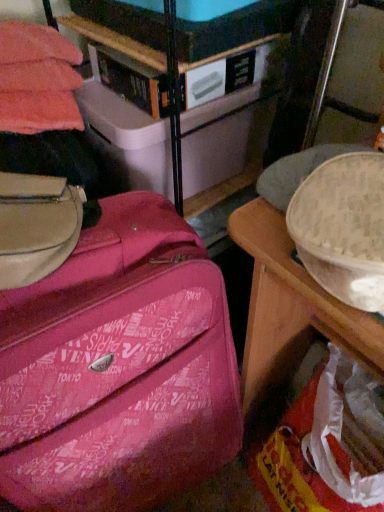
This screenshot has height=512, width=384. What are the coordinates of `pink fabric suitcase at center` in the screenshot? It's located at (118, 368).

Measure the distance between pink fabric suitcase at center and camera.

A distance of 20.51 inches exists between pink fabric suitcase at center and camera.

The height and width of the screenshot is (512, 384). Describe the element at coordinates (118, 368) in the screenshot. I see `pink fabric suitcase at center` at that location.

At what (x,y) coordinates should I click in order to perform the action: click on matte white storage box at upper center. Please return your answer as a coordinate pair (x, y). Image resolution: width=384 pixels, height=512 pixels. Looking at the image, I should click on (221, 139).

The image size is (384, 512). Describe the element at coordinates (221, 139) in the screenshot. I see `matte white storage box at upper center` at that location.

Measure the distance between point (130, 142) and camera.

Point (130, 142) is 31.30 inches away from camera.

The width and height of the screenshot is (384, 512). I want to click on pink fabric suitcase at center, so click(x=118, y=368).

Which is more to the left, pink fabric suitcase at center or matte white storage box at upper center?

From the viewer's perspective, pink fabric suitcase at center appears more on the left side.

Is pink fabric suitcase at center closer to camera compared to matte white storage box at upper center?

Yes, it is in front of matte white storage box at upper center.

Between point (124, 444) and point (91, 135), which one is positioned behind?

The point (91, 135) is more distant.

From the image's perspective, which one is positioned higher, pink fabric suitcase at center or matte white storage box at upper center?

matte white storage box at upper center.

From a real-world perspective, which is physically below, pink fabric suitcase at center or matte white storage box at upper center?

pink fabric suitcase at center is physically lower.

Is pink fabric suitcase at center wider than matte white storage box at upper center?

Indeed, pink fabric suitcase at center has a greater width compared to matte white storage box at upper center.

Can you confirm if pink fabric suitcase at center is shorter than matte white storage box at upper center?

Incorrect, the height of pink fabric suitcase at center does not fall short of that of matte white storage box at upper center.

Can you confirm if pink fabric suitcase at center is smaller than matte white storage box at upper center?

No, pink fabric suitcase at center is not smaller than matte white storage box at upper center.

Would you say pink fabric suitcase at center is inside or outside matte white storage box at upper center?

pink fabric suitcase at center is not enclosed by matte white storage box at upper center.

Is pink fabric suitcase at center in contact with matte white storage box at upper center?

No, pink fabric suitcase at center is not in contact with matte white storage box at upper center.

Is pink fabric suitcase at center positioned with its back to matte white storage box at upper center?

No, pink fabric suitcase at center's orientation is not away from matte white storage box at upper center.

How far apart are pink fabric suitcase at center and matte white storage box at upper center?

pink fabric suitcase at center and matte white storage box at upper center are 14.56 inches apart.

You are a GUI agent. You are given a task and a screenshot of the screen. Output one action in this format:
    pyautogui.click(x=<x>, y=<y>)
    Task: Click on the suitcase located underneath the matte white storage box at upper center (from a real-world perspective)
    The width and height of the screenshot is (384, 512).
    Given the screenshot: What is the action you would take?
    pyautogui.click(x=118, y=368)

Considering the relative positions of matte white storage box at upper center and pink fabric suitcase at center in the image provided, is matte white storage box at upper center to the right of pink fabric suitcase at center from the viewer's perspective?

Correct, you'll find matte white storage box at upper center to the right of pink fabric suitcase at center.

Is matte white storage box at upper center positioned before pink fabric suitcase at center?

No, it is not.

Is point (263, 138) less distant than point (101, 277)?

No, (263, 138) is behind (101, 277).

From the image's perspective, is matte white storage box at upper center located above or below pink fabric suitcase at center?

matte white storage box at upper center is above pink fabric suitcase at center.

From a real-world perspective, which object rests below the other?

pink fabric suitcase at center.

Looking at this image, between matte white storage box at upper center and pink fabric suitcase at center, which one has smaller width?

Thinner between the two is matte white storage box at upper center.

In the scene shown: Who is shorter, matte white storage box at upper center or pink fabric suitcase at center?

matte white storage box at upper center.

Who is bigger, matte white storage box at upper center or pink fabric suitcase at center?

pink fabric suitcase at center.

Is matte white storage box at upper center located outside pink fabric suitcase at center?

matte white storage box at upper center lies outside pink fabric suitcase at center's area.

Can you see matte white storage box at upper center touching pink fabric suitcase at center?

No, matte white storage box at upper center is not beside pink fabric suitcase at center.

Is matte white storage box at upper center facing towards pink fabric suitcase at center?

No, matte white storage box at upper center is not facing towards pink fabric suitcase at center.

This screenshot has width=384, height=512. I want to click on storage box behind the pink fabric suitcase at center, so click(x=221, y=139).

Find the location of a particular element. suitcase located on the left of matte white storage box at upper center is located at coordinates (118, 368).

Where is `suitcase in front of the matte white storage box at upper center`? suitcase in front of the matte white storage box at upper center is located at coordinates (118, 368).